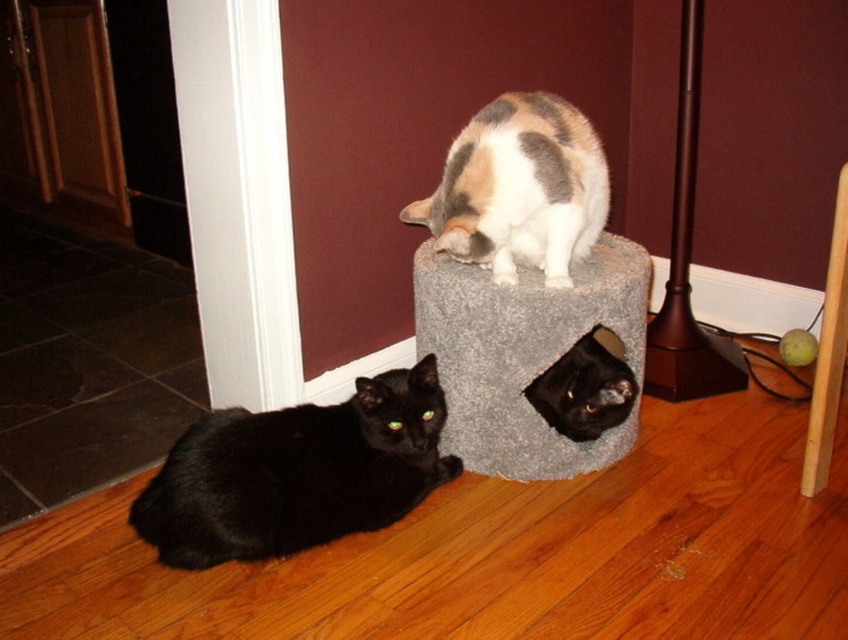
Question: Does black fur cat at lower left lie behind black fur cat at lower center?

Choices:
 (A) yes
 (B) no

Answer: (B)

Question: Which is nearer to the calico fur cat at upper center?

Choices:
 (A) gray carpeted cat bed at center
 (B) black fur cat at lower center

Answer: (A)

Question: Which of the following is the closest to the observer?

Choices:
 (A) black fur cat at lower left
 (B) black fur cat at lower center
 (C) gray carpeted cat bed at center

Answer: (A)

Question: Is gray carpeted cat bed at center to the right of black fur cat at lower center from the viewer's perspective?

Choices:
 (A) no
 (B) yes

Answer: (A)

Question: Is gray carpeted cat bed at center above calico fur cat at upper center?

Choices:
 (A) no
 (B) yes

Answer: (A)

Question: Among these objects, which one is nearest to the camera?

Choices:
 (A) gray carpeted cat bed at center
 (B) calico fur cat at upper center
 (C) black fur cat at lower center
 (D) black fur cat at lower left

Answer: (D)